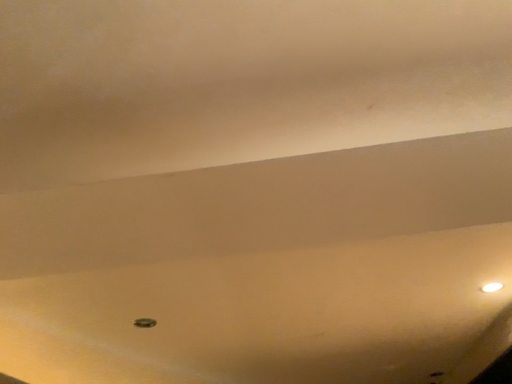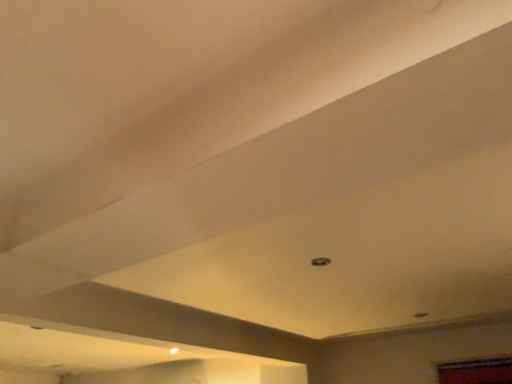
Question: How did the camera likely rotate when shooting the video?

Choices:
 (A) rotated right
 (B) rotated left

Answer: (B)